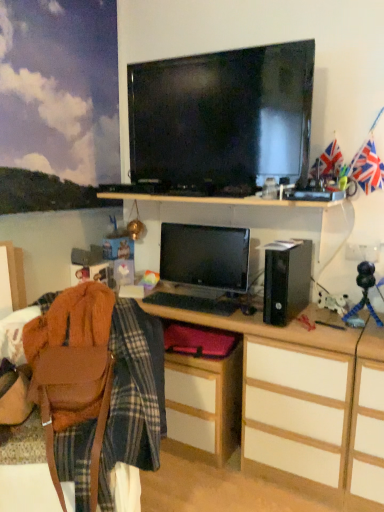
Measure the distance between point [248,111] and camera.

The distance of point [248,111] from camera is 1.86 meters.

Locate an element on the screen. The height and width of the screenshot is (512, 384). matte black television at upper center is located at coordinates (222, 120).

Measure the distance between point [279,262] and camera.

The distance of point [279,262] from camera is 5.93 feet.

Locate an element on the screen. black plastic speaker at right is located at coordinates (286, 280).

What is the approximate width of matte wood cabinet at lower center?

The width of matte wood cabinet at lower center is 12.15 inches.

The image size is (384, 512). What do you see at coordinates (367, 168) in the screenshot? I see `union jack flag at upper right` at bounding box center [367, 168].

What is the approximate height of satin black monitor at center?

37.58 centimeters.

The width and height of the screenshot is (384, 512). I want to click on matte black television at upper center, so click(x=222, y=120).

Between matte wood cabinet at lower center and black plastic speaker at right, which one has smaller width?

matte wood cabinet at lower center is thinner.

Are matte wood cabinet at lower center and black plastic speaker at right making contact?

matte wood cabinet at lower center and black plastic speaker at right are not in contact.

Is matte wood cabinet at lower center behind black plastic speaker at right?

Yes, the depth of matte wood cabinet at lower center is greater than that of black plastic speaker at right.

Consider the image. Could black plastic speaker at right be considered to be inside matte wood cabinet at lower center?

No, black plastic speaker at right is not inside matte wood cabinet at lower center.

In the scene shown: Is black plastic speaker at right in front of or behind matte wood cabinet at lower center in the image?

Visually, black plastic speaker at right is located in front of matte wood cabinet at lower center.

At what (x,y) coordinates should I click in order to perform the action: click on speaker located in front of the matte wood cabinet at lower center. Please return your answer as a coordinate pair (x, y). Image resolution: width=384 pixels, height=512 pixels. Looking at the image, I should click on (286, 280).

Can you confirm if black plastic speaker at right is bigger than matte wood cabinet at lower center?

No, black plastic speaker at right is not bigger than matte wood cabinet at lower center.

Is black plastic speaker at right positioned beyond the bounds of matte wood cabinet at lower center?

black plastic speaker at right is positioned outside matte wood cabinet at lower center.

Between matte wood cabinet at lower center and wooden desk at center, which one has larger size?

wooden desk at center is bigger.

Is point (237, 387) less distant than point (322, 402)?

No, it is not.

Considering the relative positions of matte wood cabinet at lower center and wooden desk at center in the image provided, is matte wood cabinet at lower center behind wooden desk at center?

Yes, matte wood cabinet at lower center is behind wooden desk at center.

From the image's perspective, between matte wood cabinet at lower center and wooden desk at center, who is located below?

matte wood cabinet at lower center, from the image's perspective.

Can you see black plastic speaker at right touching union jack flag at upper right?

No, black plastic speaker at right is not next to union jack flag at upper right.

Consider the image. Which of these two, black plastic speaker at right or union jack flag at upper right, is bigger?

Bigger between the two is black plastic speaker at right.

Is black plastic speaker at right oriented away from union jack flag at upper right?

No, black plastic speaker at right is not facing away from union jack flag at upper right.

What's the angular difference between black plastic speaker at right and union jack flag at upper right's facing directions?

1.32 degrees.

Does union jack flag at upper right have a lesser width compared to wooden desk at center?

Correct, the width of union jack flag at upper right is less than that of wooden desk at center.

Between union jack flag at upper right and wooden desk at center, which one has larger size?

With larger size is wooden desk at center.

Looking at this image, is union jack flag at upper right positioned beyond the bounds of wooden desk at center?

Indeed, union jack flag at upper right is completely outside wooden desk at center.

Is the surface of union jack flag at upper right in direct contact with wooden desk at center?

There is a gap between union jack flag at upper right and wooden desk at center.

Measure the distance from brown leather bag at lower left to matte wood cabinet at lower center.

brown leather bag at lower left is 25.66 inches from matte wood cabinet at lower center.

Is brown leather bag at lower left positioned with its back to matte wood cabinet at lower center?

Absolutely, brown leather bag at lower left is directed away from matte wood cabinet at lower center.

Are brown leather bag at lower left and matte wood cabinet at lower center located far from each other?

No, brown leather bag at lower left is not far away from matte wood cabinet at lower center.

Is brown leather bag at lower left completely or partially outside of matte wood cabinet at lower center?

Yes.

Considering the positions of point (373, 186) and point (262, 170), is point (373, 186) closer or farther from the camera than point (262, 170)?

Point (373, 186).

Looking at this image, from a real-world perspective, which object stands above the other?

In real-world perspective, matte black television at upper center is above.

Does union jack flag at upper right appear on the left side of matte black television at upper center?

In fact, union jack flag at upper right is to the right of matte black television at upper center.

Is union jack flag at upper right situated inside matte black television at upper center or outside?

union jack flag at upper right exists outside the volume of matte black television at upper center.

Find the location of `cabinetry below the black plastic speaker at right (from the image's perspective)`. cabinetry below the black plastic speaker at right (from the image's perspective) is located at coordinates (204, 405).

The height and width of the screenshot is (512, 384). I want to click on speaker in front of the matte wood cabinet at lower center, so click(286, 280).

Based on their spatial positions, is matte black television at upper center or satin black monitor at center closer to union jack flag at upper right?

matte black television at upper center lies closer to union jack flag at upper right than the other object.

Considering their positions, is matte black television at upper center positioned further to satin black monitor at center than matte wood cabinet at lower center?

matte wood cabinet at lower center.

Consider the image. When comparing their distances from matte wood cabinet at lower center, does matte black television at upper center or wooden desk at center seem further?

matte black television at upper center lies further to matte wood cabinet at lower center than the other object.

Based on their spatial positions, is black plastic speaker at right or satin black monitor at center further from brown leather bag at lower left?

black plastic speaker at right lies further to brown leather bag at lower left than the other object.

Looking at the image, which one is located closer to brown leather bag at lower left, matte wood cabinet at lower center or satin black monitor at center?

matte wood cabinet at lower center.

Considering their positions, is union jack flag at upper right positioned closer to matte black television at upper center than matte wood cabinet at lower center?

union jack flag at upper right is positioned closer to the anchor matte black television at upper center.

In the scene shown: When comparing their distances from black plastic speaker at right, does wooden desk at center or union jack flag at upper right seem further?

union jack flag at upper right.

Based on their spatial positions, is satin black monitor at center or union jack flag at upper right further from matte black television at upper center?

Based on the image, union jack flag at upper right appears to be further to matte black television at upper center.

What are the coordinates of `speaker between union jack flag at upper right and matte wood cabinet at lower center vertically` in the screenshot? It's located at (286, 280).

Find the location of a particular element. This screenshot has height=512, width=384. swivel chair between matte black television at upper center and wooden desk at center vertically is located at coordinates (73, 369).

This screenshot has height=512, width=384. Find the location of `desk between black plastic speaker at right and matte wood cabinet at lower center in the vertical direction`. desk between black plastic speaker at right and matte wood cabinet at lower center in the vertical direction is located at coordinates (309, 404).

Image resolution: width=384 pixels, height=512 pixels. Identify the location of desk between brown leather bag at lower left and satin black monitor at center along the z-axis. (309, 404).